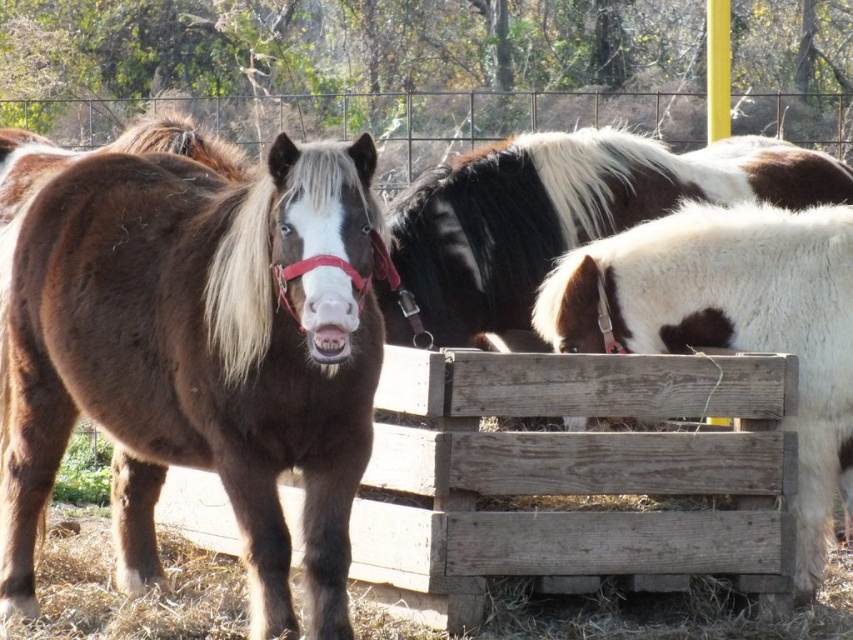
Who is more forward, (39, 410) or (521, 225)?

Point (39, 410) is more forward.

The height and width of the screenshot is (640, 853). In order to click on brown shaggy pony at center in this screenshot , I will do `click(194, 353)`.

Consider the image. Does white speckled wood at right have a lesser height compared to white-spotted fur horse at center?

Incorrect, white speckled wood at right's height does not fall short of white-spotted fur horse at center's.

Is point (839, 438) farther from viewer compared to point (637, 145)?

No, it is in front of (637, 145).

Find the location of a particular element. white speckled wood at right is located at coordinates (730, 321).

Locate an element on the screen. brown shaggy pony at center is located at coordinates (194, 353).

From the picture: Does brown shaggy pony at center have a larger size compared to white speckled wood at right?

Correct, brown shaggy pony at center is larger in size than white speckled wood at right.

Find the location of a particular element. The height and width of the screenshot is (640, 853). brown shaggy pony at center is located at coordinates (194, 353).